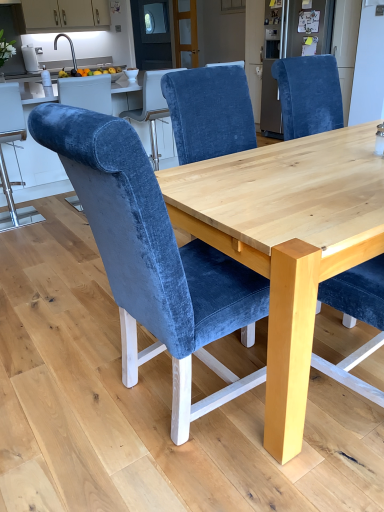
Question: Relative to velvet blue chair at left, acting as the third chair starting from the front, is natural wood table at center in front or behind?

Choices:
 (A) front
 (B) behind

Answer: (A)

Question: Considering the positions of natural wood table at center and velvet blue chair at left, acting as the third chair starting from the front, in the image, is natural wood table at center bigger or smaller than velvet blue chair at left, acting as the third chair starting from the front,?

Choices:
 (A) small
 (B) big

Answer: (B)

Question: Which is nearer to the matte white cabinets at upper left?

Choices:
 (A) velvet blue chair at upper right
 (B) velvet blue chair at left, acting as the third chair starting from the front
 (C) velvet blue chair at center, which is the second chair in left-to-right order
 (D) natural wood table at center
 (E) velvet blue chair at center, the 3th chair in the left-to-right sequence

Answer: (A)

Question: Which object is positioned farthest from the matte white cabinets at upper left?

Choices:
 (A) natural wood table at center
 (B) velvet blue chair at center, arranged as the 1th chair when viewed from the right
 (C) velvet blue chair at center, which is the second chair in left-to-right order
 (D) velvet blue chair at left, which is the 1th chair in back-to-front order
 (E) velvet blue chair at upper right

Answer: (C)